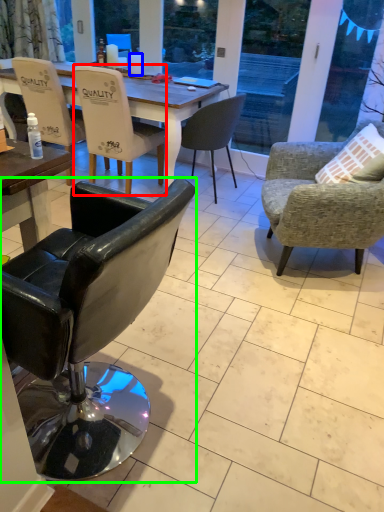
Question: Considering the real-world distances, which object is farthest from chair (highlighted by a red box)? coffee cup (highlighted by a blue box) or chair (highlighted by a green box)?

Choices:
 (A) coffee cup
 (B) chair

Answer: (B)